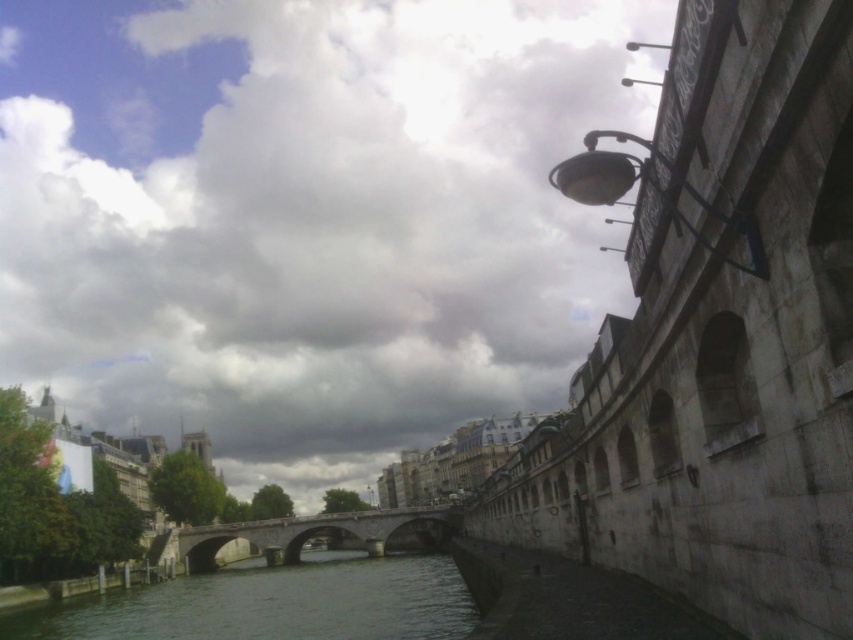
You are a photographer planning to take a picture of the cloudy sky at upper center and the stone bridge at center. Which object would appear higher in the frame?

The cloudy sky at upper center appears higher in the frame than the stone bridge at center because it is positioned over it.